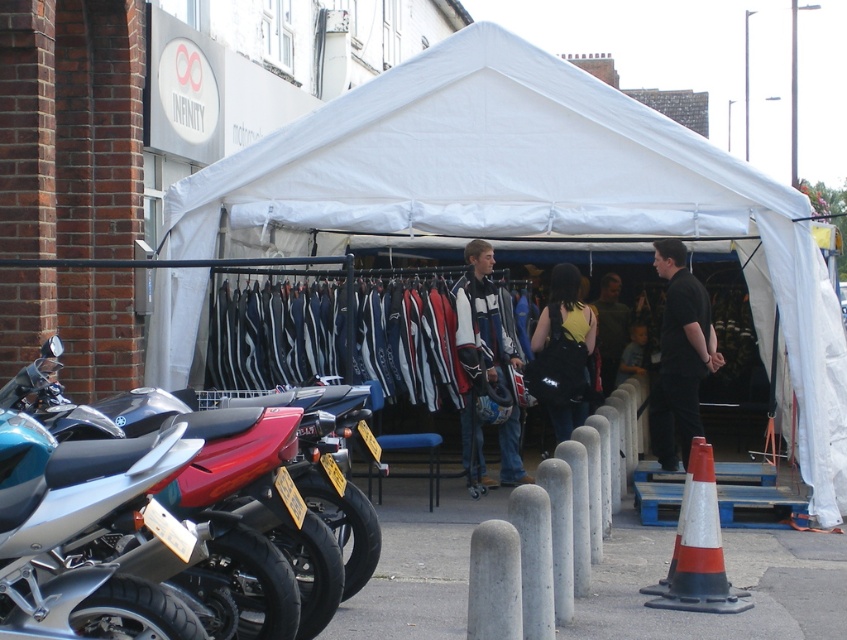
Looking at this image, you are a customer at a motorcycle event and want to try on both the black matte shirt at center and the light blue denim jacket at center. If you have a small closet space, which item might be harder to store due to its size?

The black matte shirt at center has a larger width than the light blue denim jacket at center, so it might be harder to store in a small closet space.

You are a delivery person who needs to deliver a package to the tent. You are currently standing at the black matte shirt at center. The package must be placed exactly at the light blue denim jacket at center. Given that your delivery robot has a maximum delivery range of 3.5 meters, can it successfully deliver the package?

The distance between the black matte shirt at center and the light blue denim jacket at center is 3.99 meters, which exceeds the robot delivery range of 3.5 meters. Therefore, the robot cannot deliver the package successfully.